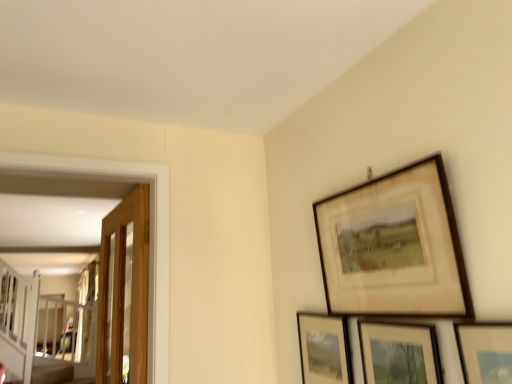
Question: Considering the relative sizes of matte wooden picture frame at lower right, which is the 3th picture frame in front-to-back order, and wooden glass door at left in the image provided, is matte wooden picture frame at lower right, which is the 3th picture frame in front-to-back order, shorter than wooden glass door at left?

Choices:
 (A) yes
 (B) no

Answer: (A)

Question: From a real-world perspective, is matte wooden picture frame at lower right, which is the 3th picture frame in front-to-back order, below wooden glass door at left?

Choices:
 (A) yes
 (B) no

Answer: (A)

Question: From the image's perspective, is matte wooden picture frame at lower right, positioned as the 2th picture frame in back-to-front order, below wooden glass door at left?

Choices:
 (A) yes
 (B) no

Answer: (B)

Question: Can we say matte wooden picture frame at lower right, positioned as the 2th picture frame in back-to-front order, lies outside wooden glass door at left?

Choices:
 (A) no
 (B) yes

Answer: (B)

Question: Considering the relative sizes of matte wooden picture frame at lower right, positioned as the 2th picture frame in back-to-front order, and wooden glass door at left in the image provided, is matte wooden picture frame at lower right, positioned as the 2th picture frame in back-to-front order, wider than wooden glass door at left?

Choices:
 (A) no
 (B) yes

Answer: (A)

Question: Is matte wooden picture frame at lower right, which is the 3th picture frame in front-to-back order, at the left side of wooden glass door at left?

Choices:
 (A) yes
 (B) no

Answer: (B)

Question: Is matte wooden picture frame at lower right, which is the 3th picture frame in front-to-back order, further to the viewer compared to matte wooden picture frame at lower right, the 4th picture frame viewed from the back?

Choices:
 (A) yes
 (B) no

Answer: (A)

Question: Considering the relative positions of matte wooden picture frame at lower right, which is the 3th picture frame in front-to-back order, and matte wooden picture frame at lower right, the 4th picture frame viewed from the back, in the image provided, is matte wooden picture frame at lower right, which is the 3th picture frame in front-to-back order, in front of matte wooden picture frame at lower right, the 4th picture frame viewed from the back,?

Choices:
 (A) yes
 (B) no

Answer: (B)

Question: Considering the relative sizes of matte wooden picture frame at lower right, positioned as the 2th picture frame in back-to-front order, and matte wooden picture frame at lower right, the first picture frame viewed from the front, in the image provided, is matte wooden picture frame at lower right, positioned as the 2th picture frame in back-to-front order, shorter than matte wooden picture frame at lower right, the first picture frame viewed from the front,?

Choices:
 (A) no
 (B) yes

Answer: (A)

Question: Considering the relative positions of matte wooden picture frame at lower right, positioned as the 2th picture frame in back-to-front order, and matte wooden picture frame at lower right, the 4th picture frame viewed from the back, in the image provided, is matte wooden picture frame at lower right, positioned as the 2th picture frame in back-to-front order, to the left of matte wooden picture frame at lower right, the 4th picture frame viewed from the back, from the viewer's perspective?

Choices:
 (A) yes
 (B) no

Answer: (A)

Question: Considering the relative sizes of matte wooden picture frame at lower right, which is the 3th picture frame in front-to-back order, and matte wooden picture frame at lower right, the first picture frame viewed from the front, in the image provided, is matte wooden picture frame at lower right, which is the 3th picture frame in front-to-back order, thinner than matte wooden picture frame at lower right, the first picture frame viewed from the front,?

Choices:
 (A) no
 (B) yes

Answer: (B)

Question: Is matte wooden picture frame at lower right, which is the 3th picture frame in front-to-back order, far away from matte wooden picture frame at lower right, the first picture frame viewed from the front?

Choices:
 (A) no
 (B) yes

Answer: (A)

Question: From the image's perspective, would you say matte black picture frame at lower right, the 4th picture frame positioned from the front, is positioned over wooden glass door at left?

Choices:
 (A) yes
 (B) no

Answer: (B)